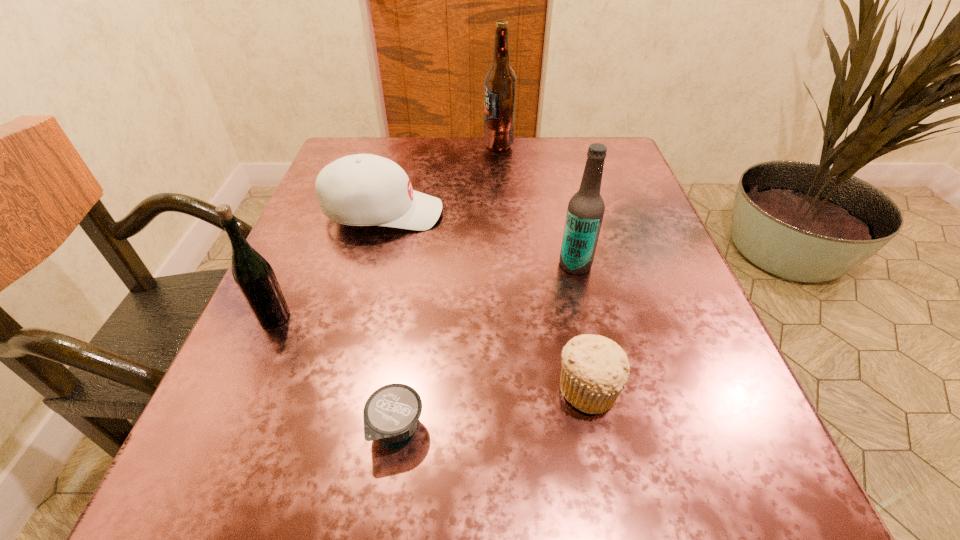
Find the location of a particular element. The height and width of the screenshot is (540, 960). vacant point located between the muffin and the fourth tallest object is located at coordinates (486, 301).

Identify the location of object that stands as the second closest to the muffin. (585, 212).

Where is `the second closest object to the leftmost beer bottle`? The width and height of the screenshot is (960, 540). the second closest object to the leftmost beer bottle is located at coordinates (392, 412).

Choose which beer bottle is the second nearest neighbor to the yogurt. Please provide its 2D coordinates. Your answer should be formatted as a tuple, i.e. [(x, y)], where the tuple contains the x and y coordinates of a point satisfying the conditions above.

[(585, 212)]

Locate an element on the screen. Image resolution: width=960 pixels, height=540 pixels. beer bottle that is the second closest to the yogurt is located at coordinates (585, 212).

Where is `vacant position in the image that satisfies the following two spatial constraints: 1. on the label of the fifth tallest object; 2. on the left side of the second beer bottle from right to left`? The height and width of the screenshot is (540, 960). vacant position in the image that satisfies the following two spatial constraints: 1. on the label of the fifth tallest object; 2. on the left side of the second beer bottle from right to left is located at coordinates (514, 388).

Image resolution: width=960 pixels, height=540 pixels. Find the location of `free region that satisfies the following two spatial constraints: 1. on the label of the rightmost beer bottle; 2. on the front side of the yogurt`. free region that satisfies the following two spatial constraints: 1. on the label of the rightmost beer bottle; 2. on the front side of the yogurt is located at coordinates (612, 427).

Find the location of a particular element. The image size is (960, 540). vacant region that satisfies the following two spatial constraints: 1. on the back side of the muffin; 2. on the front-facing side of the baseball cap is located at coordinates (553, 213).

At what (x,y) coordinates should I click in order to perform the action: click on vacant position in the image that satisfies the following two spatial constraints: 1. on the label of the third farthest object; 2. on the front side of the leftmost beer bottle. Please return your answer as a coordinate pair (x, y). This screenshot has height=540, width=960. Looking at the image, I should click on (588, 317).